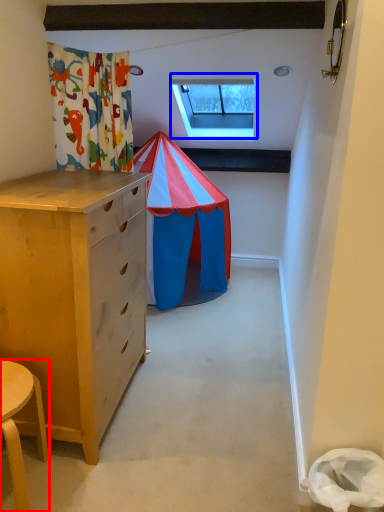
Question: Which point is closer to the camera, table (highlighted by a red box) or window (highlighted by a blue box)?

Choices:
 (A) table
 (B) window

Answer: (A)